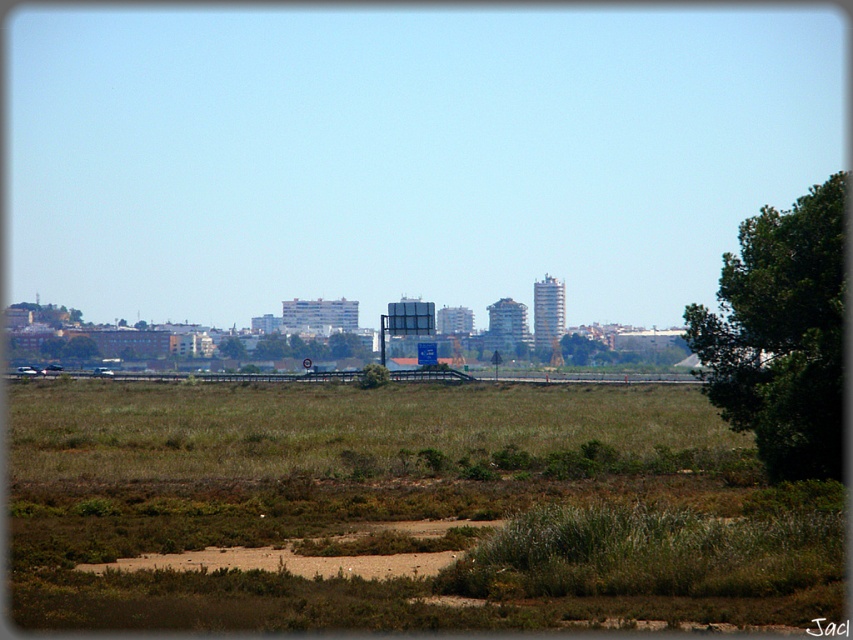
Question: Does brown dry grass at lower center have a lesser width compared to green leafy tree at right?

Choices:
 (A) no
 (B) yes

Answer: (A)

Question: From the image, what is the correct spatial relationship of brown dry grass at lower center in relation to green leafy tree at right?

Choices:
 (A) above
 (B) below

Answer: (B)

Question: Which of the following is the farthest from the observer?

Choices:
 (A) green leafy tree at center
 (B) green leafy tree at right

Answer: (A)

Question: Which object appears closest to the camera in this image?

Choices:
 (A) green leafy tree at center
 (B) brown dry grass at lower center
 (C) green leafy tree at right

Answer: (B)

Question: Can you confirm if brown dry grass at lower center is smaller than green leafy tree at right?

Choices:
 (A) yes
 (B) no

Answer: (B)

Question: Which point is farther to the camera?

Choices:
 (A) (805, 232)
 (B) (648, 392)
 (C) (341, 337)

Answer: (C)